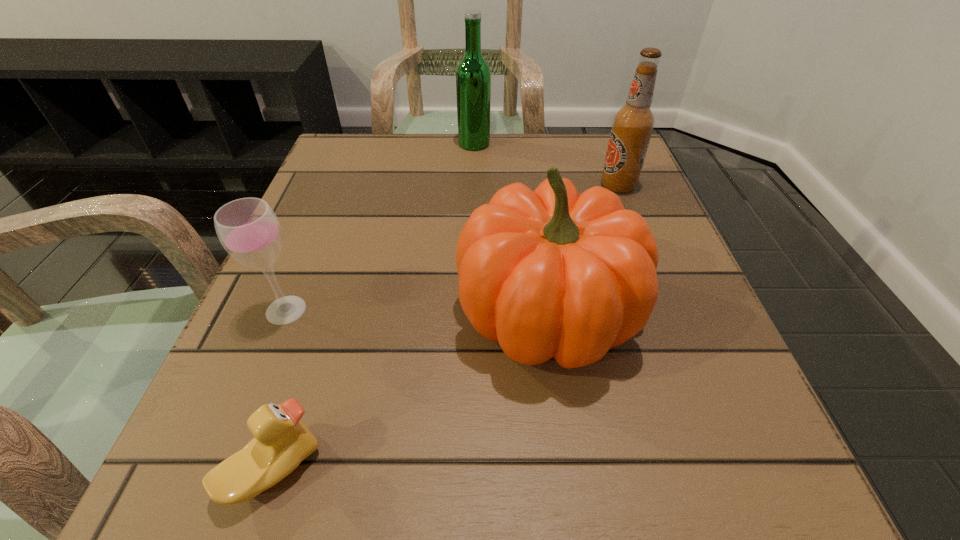
This screenshot has width=960, height=540. Identify the location of blank region between the farthest object and the duck. (373, 306).

I want to click on free spot between the left beer bottle and the duck, so click(373, 306).

The height and width of the screenshot is (540, 960). Identify the location of vacant area between the fourth tallest object and the farther beer bottle. (380, 227).

You are a GUI agent. You are given a task and a screenshot of the screen. Output one action in this format:
    pyautogui.click(x=<x>, y=<y>)
    Task: Click on the vacant area that lies between the pumpkin and the duck
    
    Given the screenshot: What is the action you would take?
    pyautogui.click(x=411, y=390)

Locate an element on the screen. This screenshot has width=960, height=540. free space between the duck and the pumpkin is located at coordinates (411, 390).

The image size is (960, 540). Identify the location of free space between the farther beer bottle and the duck. (373, 306).

The height and width of the screenshot is (540, 960). Identify the location of object that stands as the fourth closest to the farthest object. (281, 441).

Where is `the fourth closest object to the wineglass`? the fourth closest object to the wineglass is located at coordinates (632, 126).